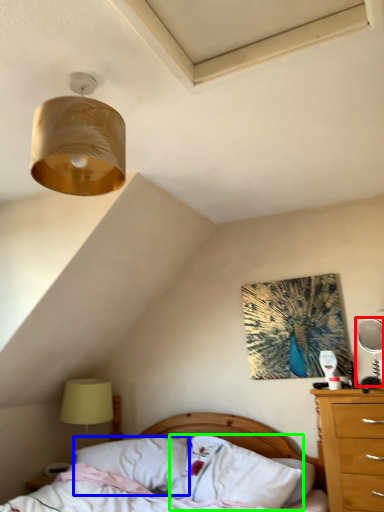
Question: Based on their relative distances, which object is nearer to mechanical fan (highlighted by a red box)? Choose from pillow (highlighted by a blue box) and pillow (highlighted by a green box).

Choices:
 (A) pillow
 (B) pillow

Answer: (B)